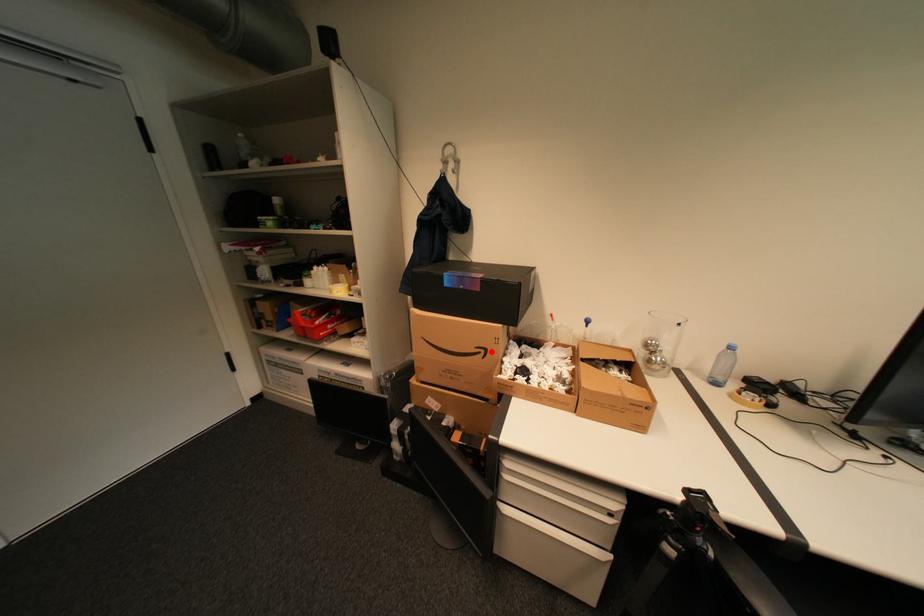
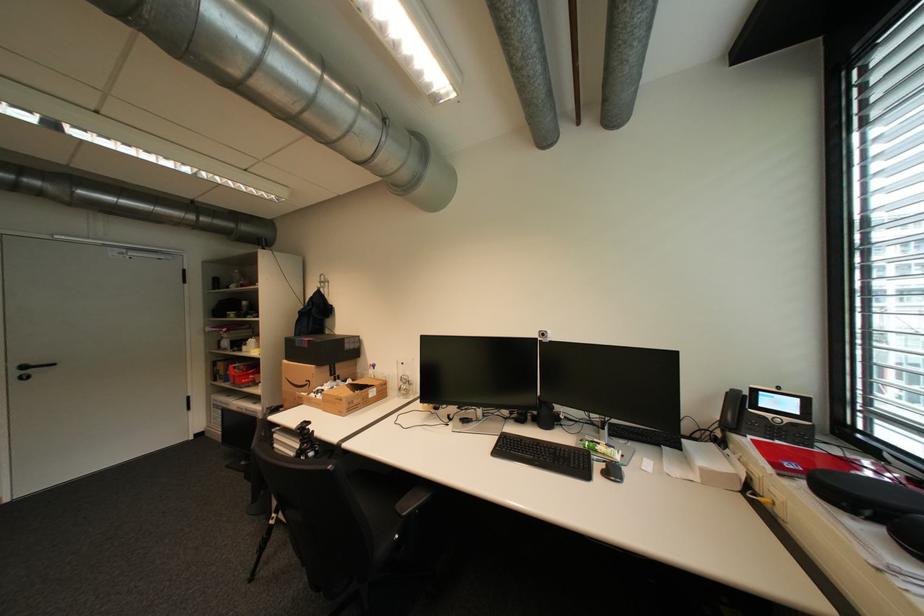
The point at the highlighted location is marked in the first image. Where is the corresponding point in the second image?

(317, 383)